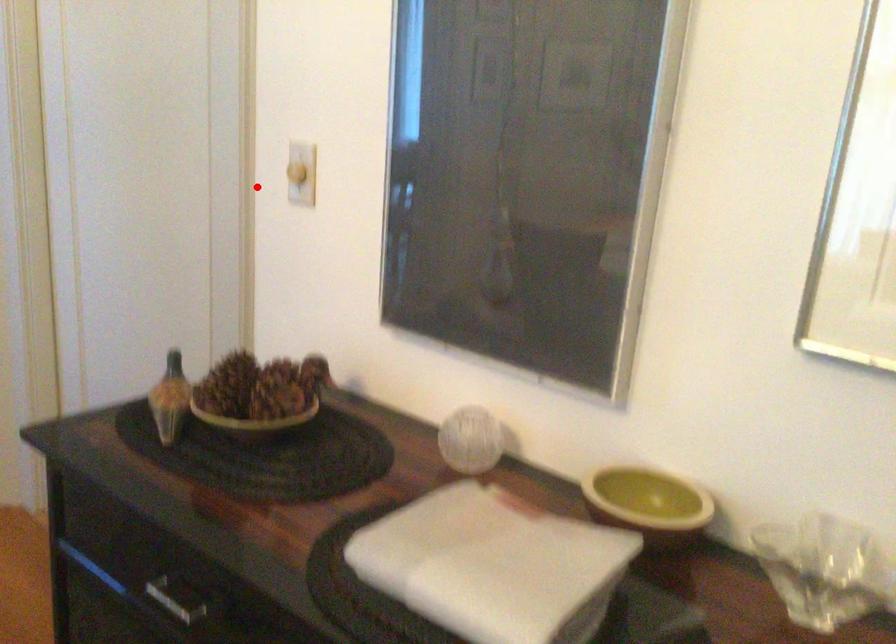
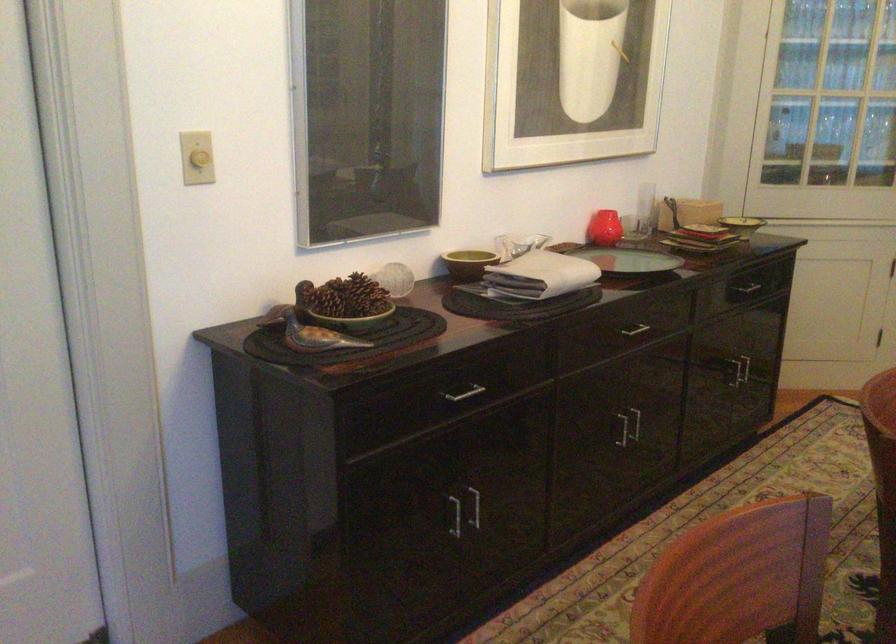
Find the pixel in the second image that matches the highlighted location in the first image.

(200, 158)